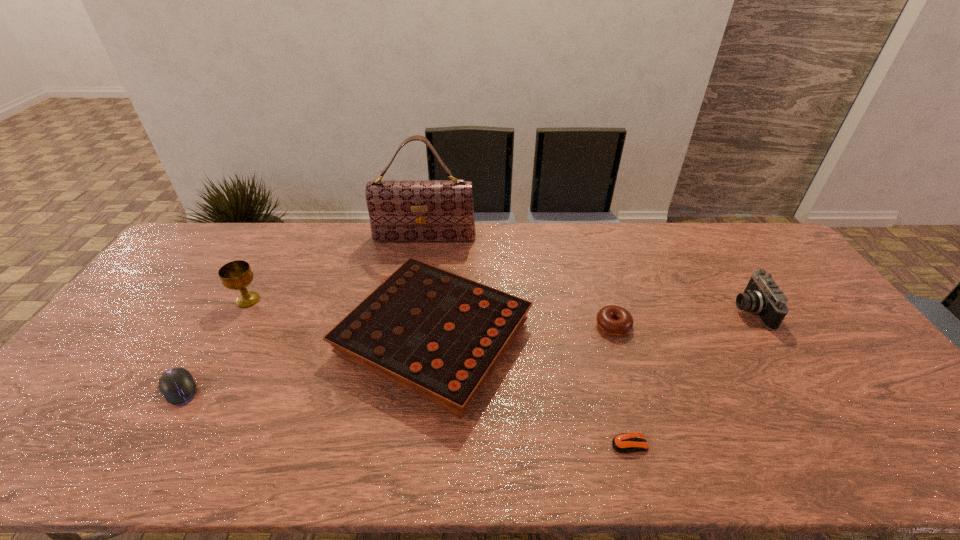
In order to click on free location located on the front of the handbag with the clasp in this screenshot , I will do `click(421, 255)`.

The height and width of the screenshot is (540, 960). Identify the location of free space located 0.270m on the front of the chalice. (200, 386).

You are a GUI agent. You are given a task and a screenshot of the screen. Output one action in this format:
    pyautogui.click(x=<x>, y=<y>)
    Task: Click on the vacant space located on the front-facing side of the rightmost object
    This screenshot has height=540, width=960.
    Given the screenshot: What is the action you would take?
    [x=694, y=310]

Where is `free spot located on the front-facing side of the rightmost object`? The width and height of the screenshot is (960, 540). free spot located on the front-facing side of the rightmost object is located at coordinates (698, 310).

Where is `free point located on the front-facing side of the rightmost object`? The image size is (960, 540). free point located on the front-facing side of the rightmost object is located at coordinates [684, 310].

You are a GUI agent. You are given a task and a screenshot of the screen. Output one action in this format:
    pyautogui.click(x=<x>, y=<y>)
    Task: Click on the blank space located on the left of the gameboard
    The width and height of the screenshot is (960, 540).
    Given the screenshot: What is the action you would take?
    pyautogui.click(x=207, y=338)

The image size is (960, 540). In order to click on vacant point located on the front of the doughnut in this screenshot , I will do `click(625, 364)`.

Locate an element on the screen. The height and width of the screenshot is (540, 960). vacant space located 0.070m on the right of the farther computer mouse is located at coordinates (228, 389).

This screenshot has height=540, width=960. What are the coordinates of `blank space located 0.390m on the left of the shorter computer mouse` in the screenshot? It's located at (440, 444).

Where is `object positioned at the far edge`? This screenshot has height=540, width=960. object positioned at the far edge is located at coordinates (399, 210).